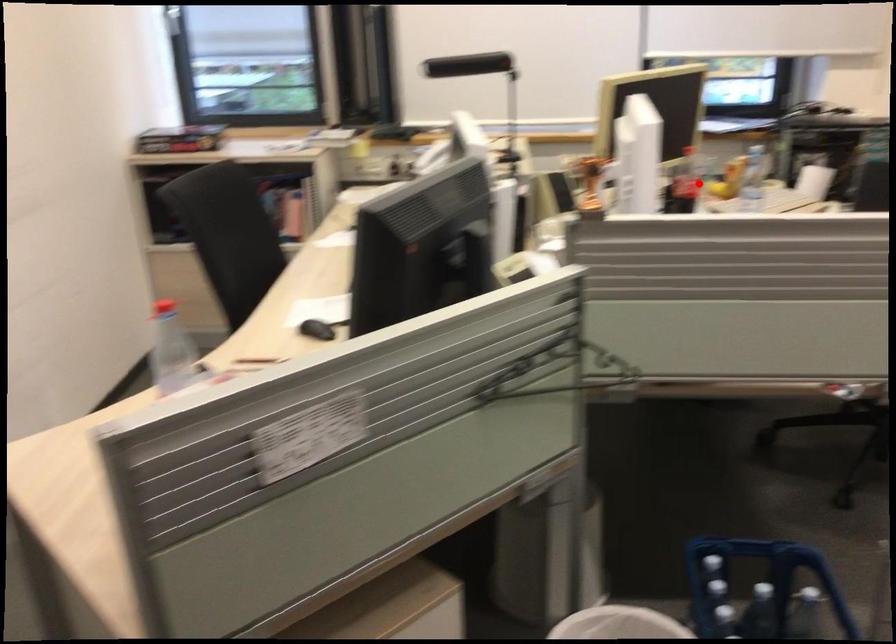
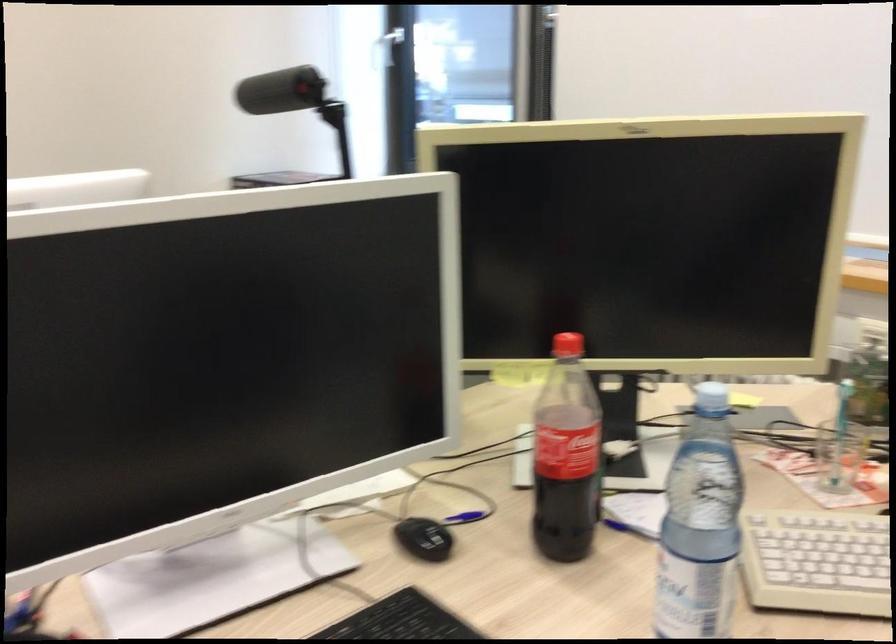
Question: I am providing you with two images of the same scene from different viewpoints. Image1 has a red point marked. In image2, the corresponding 3D location appears at what relative position? Reply with the corresponding letter.

Choices:
 (A) Closer
 (B) Farther

Answer: (A)